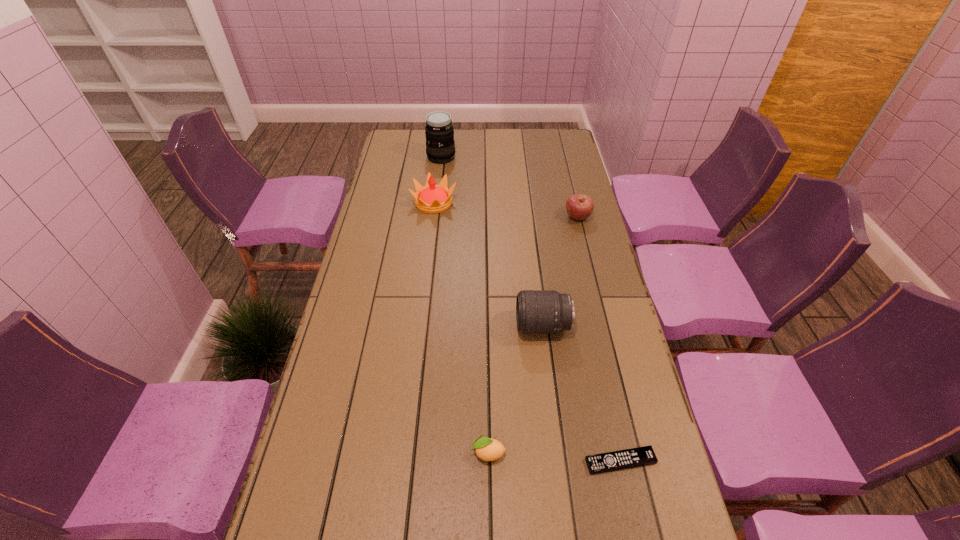
You are a GUI agent. You are given a task and a screenshot of the screen. Output one action in this format:
    pyautogui.click(x=<x>, y=<y>)
    Task: Click on the free area in between the left telephoto lens and the lemon
    This screenshot has width=960, height=540.
    Given the screenshot: What is the action you would take?
    pyautogui.click(x=465, y=305)

This screenshot has height=540, width=960. I want to click on vacant space in between the crown and the apple, so point(506,210).

The height and width of the screenshot is (540, 960). What are the coordinates of `free area in between the farther telephoto lens and the fourth tallest object` in the screenshot? It's located at (510, 187).

This screenshot has width=960, height=540. Identify the location of free spot between the farthest object and the third nearest object. (492, 241).

The image size is (960, 540). I want to click on free spot between the crown and the farthest object, so click(x=438, y=180).

The height and width of the screenshot is (540, 960). What are the coordinates of `free space between the second shortest object and the crown` in the screenshot? It's located at pyautogui.click(x=461, y=328).

The height and width of the screenshot is (540, 960). Find the location of `free point between the crown and the third shortest object`. free point between the crown and the third shortest object is located at coordinates (506, 210).

This screenshot has width=960, height=540. What are the coordinates of `vacant space that is in between the crown and the farthest object` in the screenshot? It's located at (438, 180).

At what (x,y) coordinates should I click in order to perform the action: click on free spot between the third object from left to right and the fourth tallest object. Please return your answer as a coordinate pair (x, y). The height and width of the screenshot is (540, 960). Looking at the image, I should click on (533, 335).

The height and width of the screenshot is (540, 960). Identify the location of blank region between the crown and the apple. (506, 210).